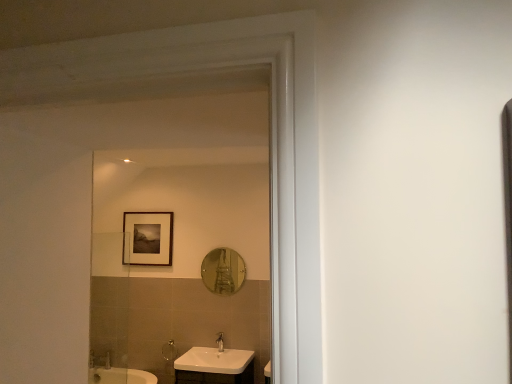
Question: Is matte white shower at lower left next to shiny silver mirror at center and touching it?

Choices:
 (A) yes
 (B) no

Answer: (B)

Question: From a real-world perspective, is matte white shower at lower left on top of shiny silver mirror at center?

Choices:
 (A) no
 (B) yes

Answer: (A)

Question: Does matte white shower at lower left have a greater width compared to shiny silver mirror at center?

Choices:
 (A) no
 (B) yes

Answer: (B)

Question: Considering the relative sizes of matte white shower at lower left and shiny silver mirror at center in the image provided, is matte white shower at lower left thinner than shiny silver mirror at center?

Choices:
 (A) yes
 (B) no

Answer: (B)

Question: Is matte white shower at lower left oriented away from shiny silver mirror at center?

Choices:
 (A) no
 (B) yes

Answer: (A)

Question: Is matte white shower at lower left smaller than shiny silver mirror at center?

Choices:
 (A) yes
 (B) no

Answer: (A)

Question: Can you see matte white shower at lower left touching matte black picture frame at upper center?

Choices:
 (A) yes
 (B) no

Answer: (B)

Question: Does matte white shower at lower left lie behind matte black picture frame at upper center?

Choices:
 (A) yes
 (B) no

Answer: (B)

Question: Can you confirm if matte white shower at lower left is smaller than matte black picture frame at upper center?

Choices:
 (A) yes
 (B) no

Answer: (A)

Question: Does matte white shower at lower left have a greater width compared to matte black picture frame at upper center?

Choices:
 (A) no
 (B) yes

Answer: (B)

Question: Can you confirm if matte white shower at lower left is bigger than matte black picture frame at upper center?

Choices:
 (A) no
 (B) yes

Answer: (A)

Question: Can you confirm if matte white shower at lower left is shorter than matte black picture frame at upper center?

Choices:
 (A) yes
 (B) no

Answer: (A)

Question: Does white glossy sink at lower center have a smaller size compared to silver metallic faucet at lower center?

Choices:
 (A) yes
 (B) no

Answer: (B)